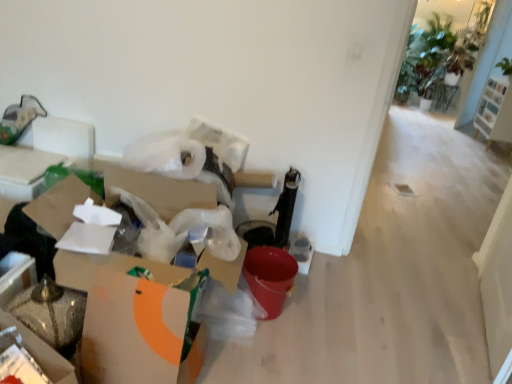
This screenshot has width=512, height=384. What do you see at coordinates (133, 321) in the screenshot?
I see `white cardboard box at left, which ranks as the second cardboard box in front-to-back order` at bounding box center [133, 321].

Locate an element on the screen. white cardboard box at left, which ranks as the second cardboard box in front-to-back order is located at coordinates (133, 321).

Locate an element on the screen. Image resolution: width=512 pixels, height=384 pixels. the 1st cardboard box located beneath the white wood shoe rack at upper right (from a real-world perspective) is located at coordinates (133, 321).

Could white cardboard box at left, the first cardboard box in the back-to-front sequence, be considered to be inside white wood shoe rack at upper right?

That's incorrect, white cardboard box at left, the first cardboard box in the back-to-front sequence, is not inside white wood shoe rack at upper right.

Can you tell me how much white wood shoe rack at upper right and white cardboard box at left, the first cardboard box in the back-to-front sequence, differ in facing direction?

white wood shoe rack at upper right and white cardboard box at left, the first cardboard box in the back-to-front sequence, are facing 180 degrees away from each other.

From the image's perspective, is white wood shoe rack at upper right positioned above or below white cardboard box at left, the first cardboard box in the back-to-front sequence?

From the image's perspective, white wood shoe rack at upper right appears above white cardboard box at left, the first cardboard box in the back-to-front sequence.

Consider the image. From the image's perspective, between white cardboard box at left, the first cardboard box in the back-to-front sequence, and white cardboard box at lower left, positioned as the first cardboard box in front-to-back order, who is located below?

white cardboard box at lower left, positioned as the first cardboard box in front-to-back order.

Is white cardboard box at left, the first cardboard box in the back-to-front sequence, facing towards white cardboard box at lower left, positioned as the first cardboard box in front-to-back order?

No, white cardboard box at left, the first cardboard box in the back-to-front sequence, is not facing towards white cardboard box at lower left, positioned as the first cardboard box in front-to-back order.

From a real-world perspective, who is located higher, white cardboard box at left, which ranks as the second cardboard box in front-to-back order, or white cardboard box at lower left, the 2th cardboard box positioned from the back?

white cardboard box at left, which ranks as the second cardboard box in front-to-back order, from a real-world perspective.

Is white cardboard box at left, the first cardboard box in the back-to-front sequence, positioned beyond the bounds of white cardboard box at lower left, the 2th cardboard box positioned from the back?

Indeed, white cardboard box at left, the first cardboard box in the back-to-front sequence, is completely outside white cardboard box at lower left, the 2th cardboard box positioned from the back.

Does point (85, 257) lie in front of point (500, 138)?

Yes, point (85, 257) is closer to viewer.

Does white cardboard box at left, the first cardboard box in the back-to-front sequence, have a greater height compared to white wood shoe rack at upper right?

Incorrect, the height of white cardboard box at left, the first cardboard box in the back-to-front sequence, is not larger of that of white wood shoe rack at upper right.

Could you tell me if white cardboard box at left, which ranks as the second cardboard box in front-to-back order, is facing white wood shoe rack at upper right?

No.

Choose the correct answer: Is white cardboard box at left, the first cardboard box in the back-to-front sequence, inside white wood shoe rack at upper right or outside it?

white cardboard box at left, the first cardboard box in the back-to-front sequence, exists outside the volume of white wood shoe rack at upper right.

Considering the positions of objects white cardboard box at lower left, the 2th cardboard box positioned from the back, and white cardboard box at left, the first cardboard box in the back-to-front sequence, in the image provided, who is more to the left, white cardboard box at lower left, the 2th cardboard box positioned from the back, or white cardboard box at left, the first cardboard box in the back-to-front sequence,?

white cardboard box at left, the first cardboard box in the back-to-front sequence, is more to the left.

From the picture: Can you see white cardboard box at lower left, the 2th cardboard box positioned from the back, touching white cardboard box at left, the first cardboard box in the back-to-front sequence?

Yes, white cardboard box at lower left, the 2th cardboard box positioned from the back, and white cardboard box at left, the first cardboard box in the back-to-front sequence, clearly make contact.

Find the location of a particular element. This screenshot has width=512, height=384. cardboard box that appears above the white cardboard box at lower left, the 2th cardboard box positioned from the back (from the image's perspective) is located at coordinates (133, 321).

Between point (119, 359) and point (488, 147), which one is positioned behind?

Point (488, 147)

From the image's perspective, which is below, white cardboard box at lower left, the 2th cardboard box positioned from the back, or white wood shoe rack at upper right?

From the image's view, white cardboard box at lower left, the 2th cardboard box positioned from the back, is below.

How far apart are white cardboard box at lower left, positioned as the first cardboard box in front-to-back order, and white wood shoe rack at upper right?

The distance of white cardboard box at lower left, positioned as the first cardboard box in front-to-back order, from white wood shoe rack at upper right is 16.54 feet.

Considering the relative sizes of white cardboard box at lower left, positioned as the first cardboard box in front-to-back order, and white wood shoe rack at upper right in the image provided, is white cardboard box at lower left, positioned as the first cardboard box in front-to-back order, taller than white wood shoe rack at upper right?

In fact, white cardboard box at lower left, positioned as the first cardboard box in front-to-back order, may be shorter than white wood shoe rack at upper right.

Are white wood shoe rack at upper right and white cardboard box at lower left, positioned as the first cardboard box in front-to-back order, far apart?

white wood shoe rack at upper right is positioned a significant distance from white cardboard box at lower left, positioned as the first cardboard box in front-to-back order.

Is white wood shoe rack at upper right facing towards white cardboard box at lower left, the 2th cardboard box positioned from the back?

No, white wood shoe rack at upper right does not turn towards white cardboard box at lower left, the 2th cardboard box positioned from the back.

Would you say white wood shoe rack at upper right is outside white cardboard box at lower left, the 2th cardboard box positioned from the back?

white wood shoe rack at upper right is positioned outside white cardboard box at lower left, the 2th cardboard box positioned from the back.

Is point (482, 124) closer or farther from the camera than point (183, 382)?

Point (482, 124) is positioned farther from the camera compared to point (183, 382).

At what (x,y) coordinates should I click in order to perform the action: click on furniture that is behind the white cardboard box at left, the first cardboard box in the back-to-front sequence. Please return your answer as a coordinate pair (x, y). Looking at the image, I should click on (495, 111).

Where is `cardboard box on the right of white cardboard box at left, which ranks as the second cardboard box in front-to-back order`? The image size is (512, 384). cardboard box on the right of white cardboard box at left, which ranks as the second cardboard box in front-to-back order is located at coordinates (132, 320).

Based on their spatial positions, is white cardboard box at left, the first cardboard box in the back-to-front sequence, or white cardboard box at lower left, the 2th cardboard box positioned from the back, further from white wood shoe rack at upper right?

white cardboard box at lower left, the 2th cardboard box positioned from the back, is positioned further to the anchor white wood shoe rack at upper right.

Based on their spatial positions, is white cardboard box at lower left, the 2th cardboard box positioned from the back, or white wood shoe rack at upper right further from white cardboard box at left, the first cardboard box in the back-to-front sequence?

Among the two, white wood shoe rack at upper right is located further to white cardboard box at left, the first cardboard box in the back-to-front sequence.

Estimate the real-world distances between objects in this image. Which object is closer to white cardboard box at lower left, the 2th cardboard box positioned from the back, white wood shoe rack at upper right or white cardboard box at left, the first cardboard box in the back-to-front sequence?

white cardboard box at left, the first cardboard box in the back-to-front sequence.

Looking at this image, looking at the image, which one is located closer to white wood shoe rack at upper right, white cardboard box at lower left, the 2th cardboard box positioned from the back, or white cardboard box at left, the first cardboard box in the back-to-front sequence?

white cardboard box at left, the first cardboard box in the back-to-front sequence, is positioned closer to the anchor white wood shoe rack at upper right.

Looking at the image, which one is located further to white cardboard box at lower left, the 2th cardboard box positioned from the back, white cardboard box at left, the first cardboard box in the back-to-front sequence, or white wood shoe rack at upper right?

Among the two, white wood shoe rack at upper right is located further to white cardboard box at lower left, the 2th cardboard box positioned from the back.

Considering their positions, is white wood shoe rack at upper right positioned closer to white cardboard box at left, which ranks as the second cardboard box in front-to-back order, than white cardboard box at lower left, positioned as the first cardboard box in front-to-back order?

Based on the image, white cardboard box at lower left, positioned as the first cardboard box in front-to-back order, appears to be nearer to white cardboard box at left, which ranks as the second cardboard box in front-to-back order.

The height and width of the screenshot is (384, 512). I want to click on cardboard box between white cardboard box at left, which ranks as the second cardboard box in front-to-back order, and white wood shoe rack at upper right from left to right, so click(132, 320).